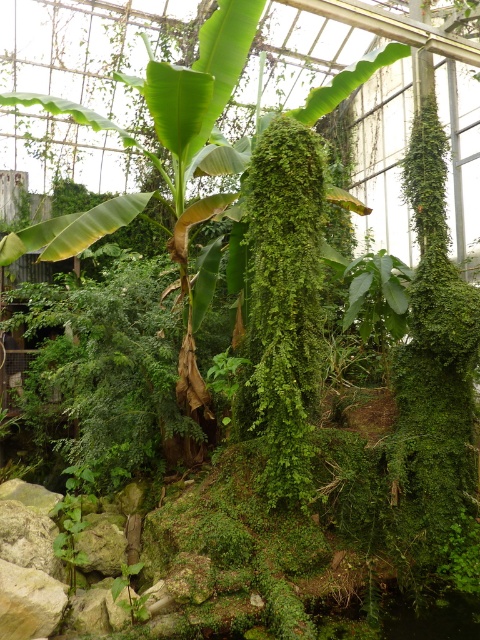
You are a gardener who wants to place a small decorative statue between the green leafy banana tree at center and the green fuzzy fern at center. Based on their positions, which side of the banana tree should the statue be placed to ensure it is between both plants?

The green leafy banana tree at center is positioned on the left side of green fuzzy fern at center, so placing the statue to the right side of the banana tree would position it between both plants.

In the indoor garden scene, there is a green leafy banana tree at center and a green fuzzy fern at center. Which of these two plants has a greater width?

The green leafy banana tree at center has a greater width than the green fuzzy fern at center.

You are a gardener who needs to water two plants in the greenhouse. You have a watering can that can hold enough water for one plant. The green leafy banana tree at center requires more water than the green fuzzy fern at center. Which plant should you water first to ensure both get enough water before the can runs out?

You should water the green leafy banana tree at center first because it requires more water. Since the watering can holds enough for one plant, you need to prioritize the one needing more water to ensure it gets its full requirement before moving to the fern.